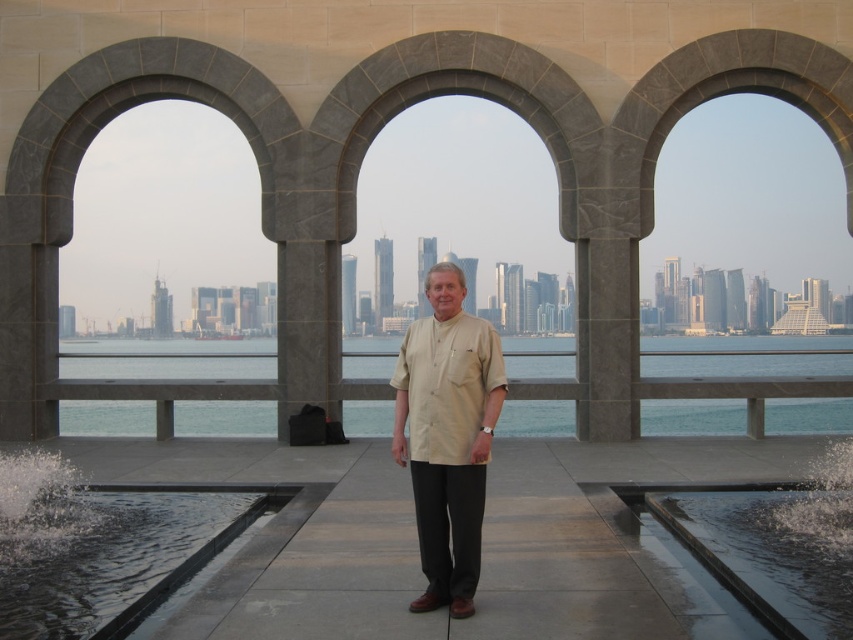
Question: Does blue water at center appear on the right side of beige cotton shirt at center?

Choices:
 (A) yes
 (B) no

Answer: (A)

Question: Is blue water at center smaller than black smooth water at lower left?

Choices:
 (A) yes
 (B) no

Answer: (B)

Question: Which object appears farthest from the camera in this image?

Choices:
 (A) blue water at center
 (B) beige cotton shirt at center
 (C) black smooth water at lower left

Answer: (A)

Question: Which point appears closest to the camera in this image?

Choices:
 (A) (90, 547)
 (B) (566, 339)
 (C) (437, 547)

Answer: (C)

Question: Considering the real-world distances, which object is farthest from the beige cotton shirt at center?

Choices:
 (A) blue water at center
 (B) black smooth water at lower left

Answer: (A)

Question: Is black smooth water at lower left closer to the viewer compared to beige cotton shirt at center?

Choices:
 (A) yes
 (B) no

Answer: (A)